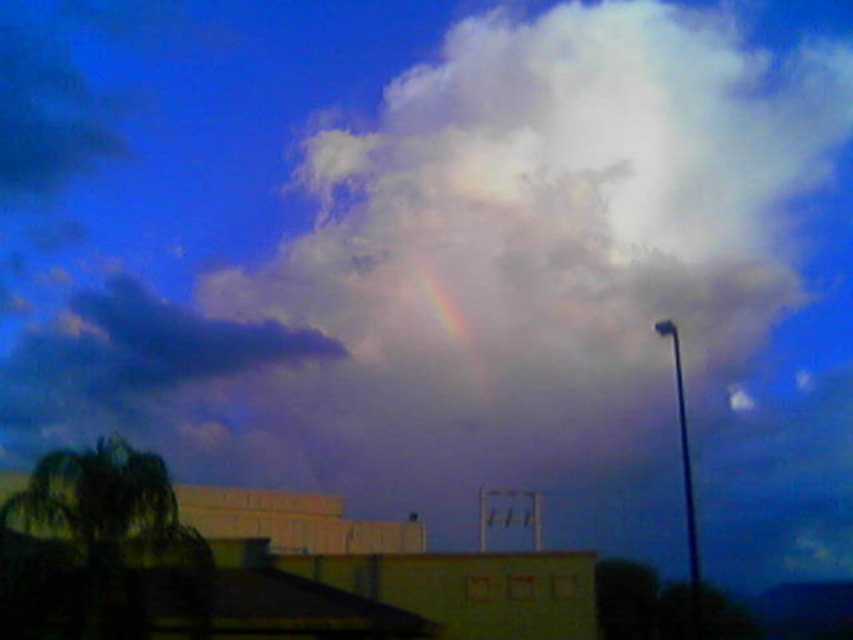
Question: Can you confirm if green leafy palm tree at lower left is thinner than rainbow at upper center?

Choices:
 (A) no
 (B) yes

Answer: (B)

Question: Is green leafy palm tree at lower left to the right of rainbow at upper center from the viewer's perspective?

Choices:
 (A) no
 (B) yes

Answer: (A)

Question: Among these points, which one is nearest to the camera?

Choices:
 (A) (78, 458)
 (B) (463, 323)

Answer: (A)

Question: Can you confirm if green leafy palm tree at lower left is bigger than rainbow at upper center?

Choices:
 (A) yes
 (B) no

Answer: (B)

Question: Among these objects, which one is nearest to the camera?

Choices:
 (A) rainbow at upper center
 (B) green leafy palm tree at lower left

Answer: (B)